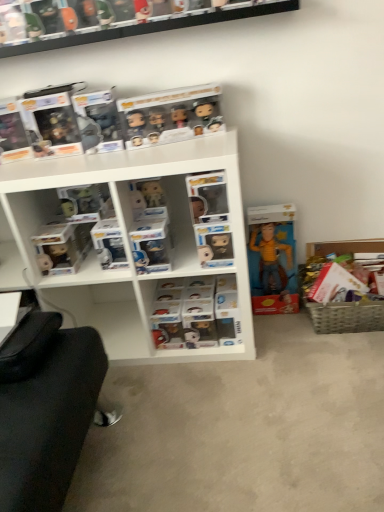
The image size is (384, 512). Identify the location of vacant area on top of clear plastic figurines at upper center, the 2th shelf positioned from the bottom (from a real-world perspective). (152, 20).